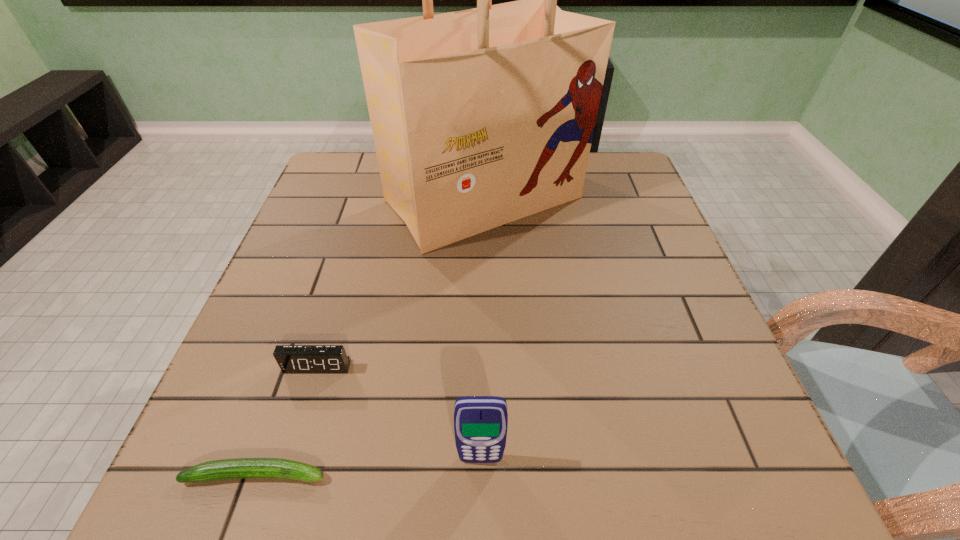
Find the location of `the farthest object`. the farthest object is located at coordinates (480, 117).

At what (x,y) coordinates should I click in order to perform the action: click on the tallest object. Please return your answer as a coordinate pair (x, y). Looking at the image, I should click on (480, 117).

This screenshot has height=540, width=960. Find the location of `cellular telephone`. cellular telephone is located at coordinates (480, 422).

You are a GUI agent. You are given a task and a screenshot of the screen. Output one action in this format:
    pyautogui.click(x=<x>, y=<y>)
    Task: Click on the alarm clock
    
    Given the screenshot: What is the action you would take?
    pyautogui.click(x=291, y=358)

Where is `the third nearest object`? the third nearest object is located at coordinates (291, 358).

The image size is (960, 540). What are the coordinates of `zucchini` in the screenshot? It's located at (240, 468).

You are a GUI agent. You are given a task and a screenshot of the screen. Output one action in this format:
    pyautogui.click(x=<x>, y=<y>)
    Task: Click on the free region located 0.190m on the side of the tallest object with the superhero design
    
    Given the screenshot: What is the action you would take?
    pyautogui.click(x=486, y=319)

Where is `vacant point located 0.120m on the front-facing side of the second farthest object`? The width and height of the screenshot is (960, 540). vacant point located 0.120m on the front-facing side of the second farthest object is located at coordinates (296, 438).

Locate an element on the screen. vacant space located 0.050m on the front-facing side of the shortest object is located at coordinates (360, 474).

The height and width of the screenshot is (540, 960). Find the location of `object located at the far edge`. object located at the far edge is located at coordinates (480, 117).